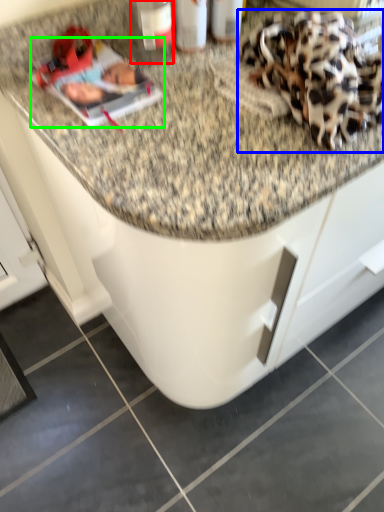
Question: Which object is the closest to the bottle (highlighted by a red box)? Choose among these: stuff (highlighted by a blue box) or magazine (highlighted by a green box).

Choices:
 (A) stuff
 (B) magazine

Answer: (B)